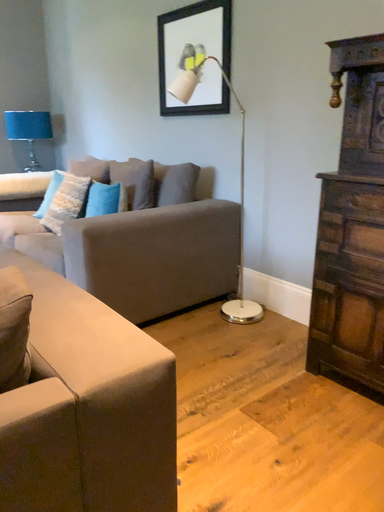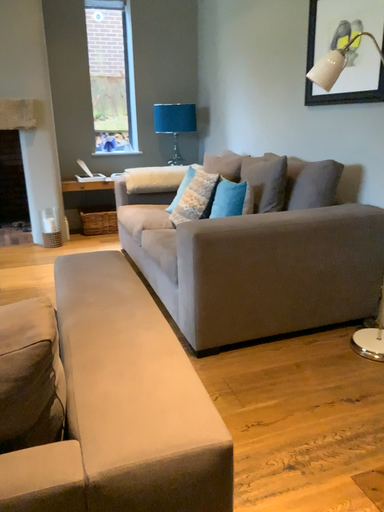
Question: Which way did the camera rotate in the video?

Choices:
 (A) rotated left
 (B) rotated right

Answer: (A)